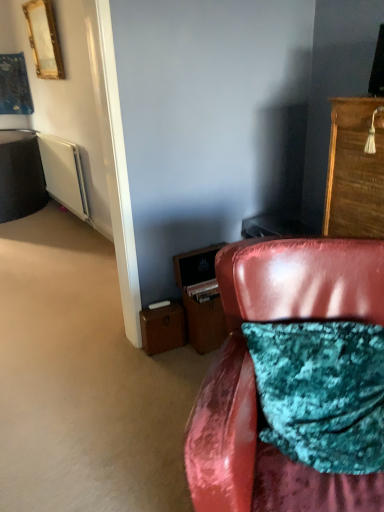
Question: From a real-world perspective, is white matte radiator at left positioned under wooden drawer at lower center, marked as the 1th drawer in a right-to-left arrangement, based on gravity?

Choices:
 (A) yes
 (B) no

Answer: (B)

Question: Is white matte radiator at left positioned behind wooden drawer at lower center, marked as the 1th drawer in a right-to-left arrangement?

Choices:
 (A) no
 (B) yes

Answer: (B)

Question: Considering the relative sizes of white matte radiator at left and wooden drawer at lower center, marked as the 1th drawer in a right-to-left arrangement, in the image provided, is white matte radiator at left smaller than wooden drawer at lower center, marked as the 1th drawer in a right-to-left arrangement,?

Choices:
 (A) no
 (B) yes

Answer: (A)

Question: Is white matte radiator at left bigger than wooden drawer at lower center, marked as the 1th drawer in a right-to-left arrangement?

Choices:
 (A) yes
 (B) no

Answer: (A)

Question: Is white matte radiator at left aimed at wooden drawer at lower center, which is counted as the second drawer, starting from the left?

Choices:
 (A) no
 (B) yes

Answer: (A)

Question: Can you confirm if white matte radiator at left is wider than wooden drawer at lower center, which is counted as the second drawer, starting from the left?

Choices:
 (A) yes
 (B) no

Answer: (B)

Question: Does wooden drawer at lower center, marked as the 1th drawer in a right-to-left arrangement, have a lesser width compared to brown leather file cabinet at lower center?

Choices:
 (A) yes
 (B) no

Answer: (A)

Question: From a real-world perspective, is wooden drawer at lower center, marked as the 1th drawer in a right-to-left arrangement, over brown leather file cabinet at lower center?

Choices:
 (A) yes
 (B) no

Answer: (B)

Question: Does wooden drawer at lower center, which is counted as the second drawer, starting from the left, have a greater height compared to brown leather file cabinet at lower center?

Choices:
 (A) no
 (B) yes

Answer: (A)

Question: Does wooden drawer at lower center, which is counted as the second drawer, starting from the left, have a larger size compared to brown leather file cabinet at lower center?

Choices:
 (A) yes
 (B) no

Answer: (B)

Question: Is wooden drawer at lower center, marked as the 1th drawer in a right-to-left arrangement, facing away from brown leather file cabinet at lower center?

Choices:
 (A) yes
 (B) no

Answer: (A)

Question: Does wooden drawer at lower center, which is counted as the second drawer, starting from the left, have a smaller size compared to brown leather file cabinet at lower center?

Choices:
 (A) no
 (B) yes

Answer: (B)

Question: Is wooden drawer at lower center, marked as the 1th drawer in a right-to-left arrangement, smaller than brown leather suitcase at lower left, acting as the 2th drawer starting from the right?

Choices:
 (A) no
 (B) yes

Answer: (A)